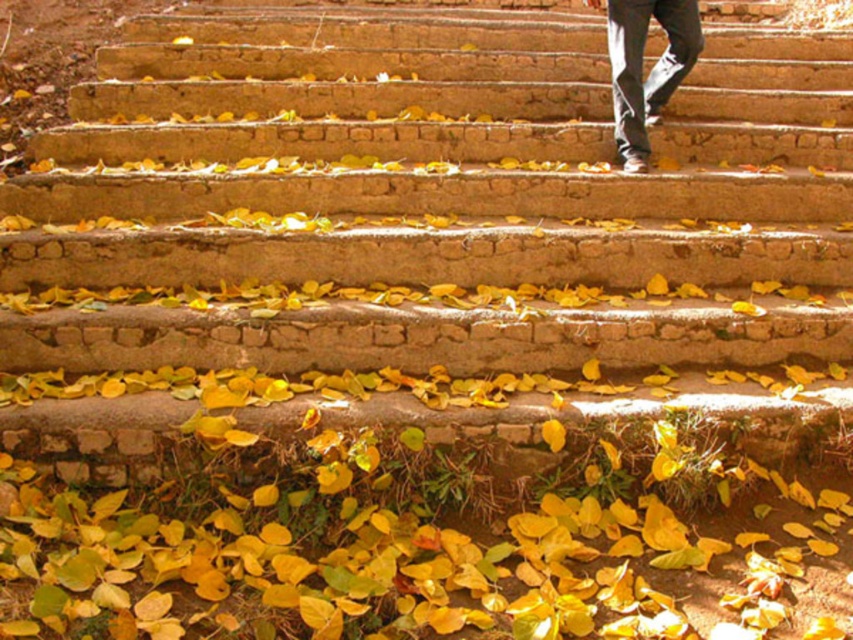
You are standing at the bottom of the stone steps and see the yellow matte leaves at bottom and the dark gray jeans at upper center. Which object is located to the left of the other?

The yellow matte leaves at bottom are positioned on the left side of dark gray jeans at upper center.

You are standing at the top of the weathered stone steps and notice yellow matte leaves at bottom. Based on their position, can you determine if they are closer to the base of the steps or further away from it?

The yellow matte leaves at bottom are located at point coordinates indicating they are at the base of the steps, so they are closer to the base rather than further away.

You are standing on the stone steps and see the yellow matte leaves at bottom and the dark gray jeans at upper center. Which object is closer to you?

The yellow matte leaves at bottom are closer to you because they are positioned under the dark gray jeans at upper center, which means the leaves are below the jeans in the scene.